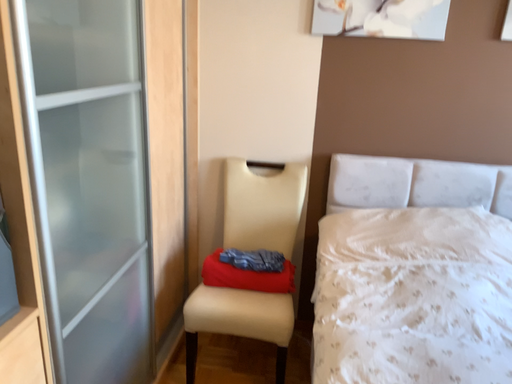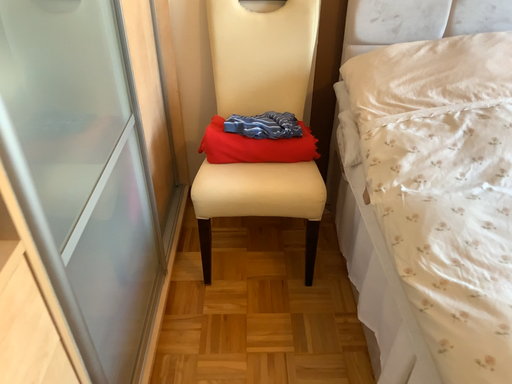
Question: How did the camera likely rotate when shooting the video?

Choices:
 (A) rotated left
 (B) rotated right

Answer: (B)